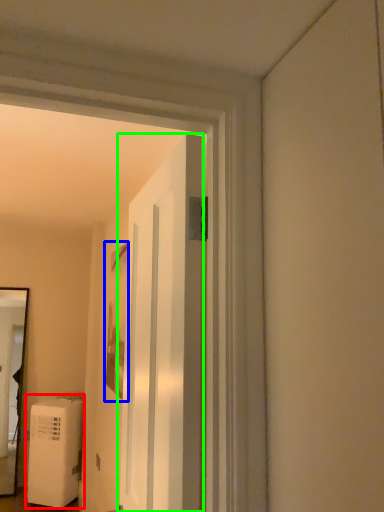
Question: Which is farther away from water heater (highlighted by a red box)? picture frame (highlighted by a blue box) or door (highlighted by a green box)?

Choices:
 (A) picture frame
 (B) door

Answer: (B)